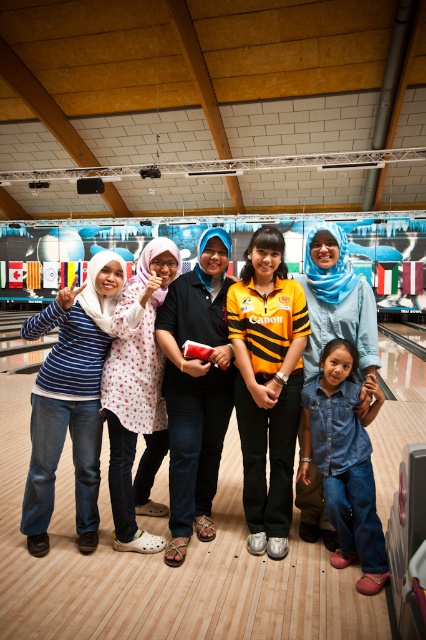
You are standing at the center of the bowling alley and see the point marked at coordinates (195, 388). Which object is located at that position?

The point at coordinates (195, 388) is located on the black matte shirt at center.